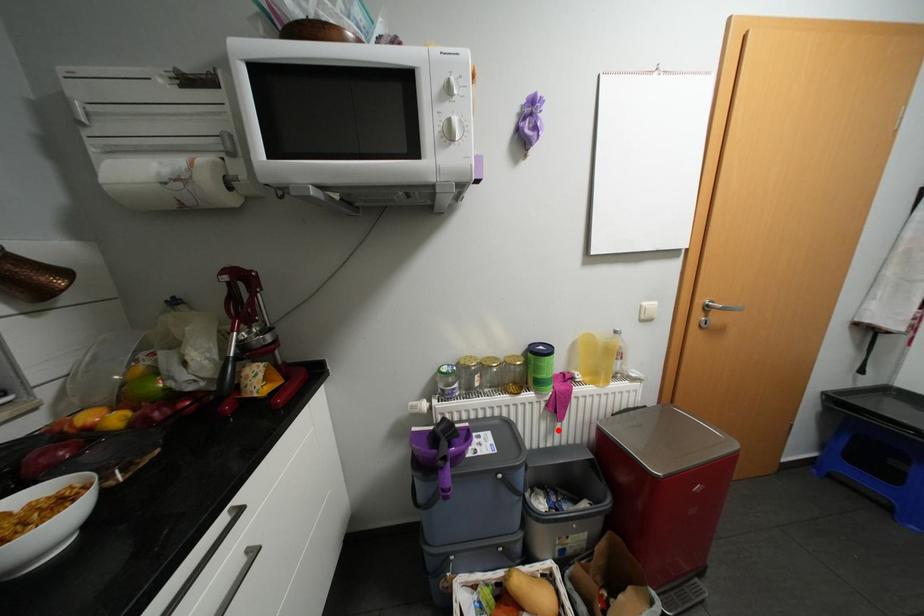
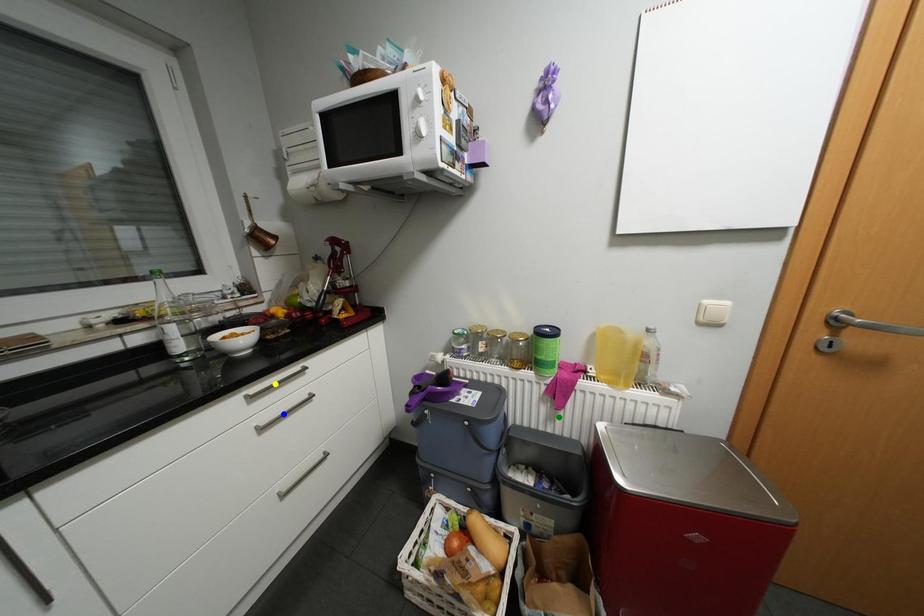
Question: I am providing you with two images of the same scene from different viewpoints. A red point is marked on the first image. You are given multiple points on the second image. Which mark in image 2 goes with the point in image 1?

Choices:
 (A) blue point
 (B) yellow point
 (C) green point

Answer: (C)